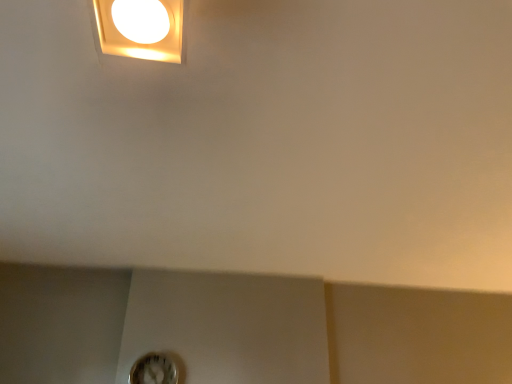
Question: Relative to white plastic light fixture at upper left, is white plastic clock at lower center in front or behind?

Choices:
 (A) behind
 (B) front

Answer: (A)

Question: From a real-world perspective, is white plastic clock at lower center positioned above or below white plastic light fixture at upper left?

Choices:
 (A) below
 (B) above

Answer: (A)

Question: Would you say white plastic clock at lower center is to the left or to the right of white plastic light fixture at upper left in the picture?

Choices:
 (A) left
 (B) right

Answer: (A)

Question: Is point (117, 48) closer or farther from the camera than point (152, 362)?

Choices:
 (A) farther
 (B) closer

Answer: (B)

Question: Do you think white plastic light fixture at upper left is within white plastic clock at lower center, or outside of it?

Choices:
 (A) inside
 (B) outside

Answer: (B)

Question: From a real-world perspective, is white plastic light fixture at upper left above or below white plastic clock at lower center?

Choices:
 (A) below
 (B) above

Answer: (B)

Question: Relative to white plastic clock at lower center, is white plastic light fixture at upper left in front or behind?

Choices:
 (A) front
 (B) behind

Answer: (A)